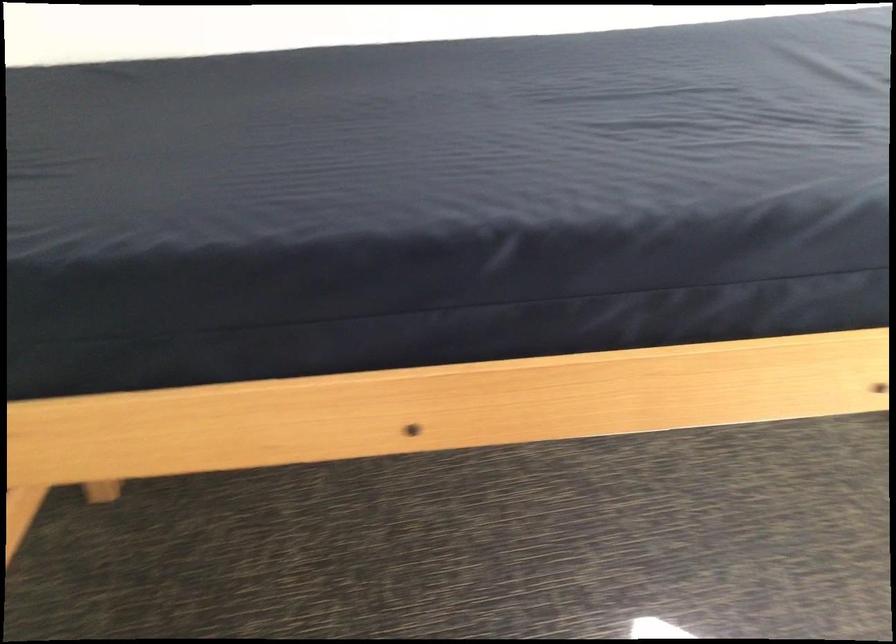
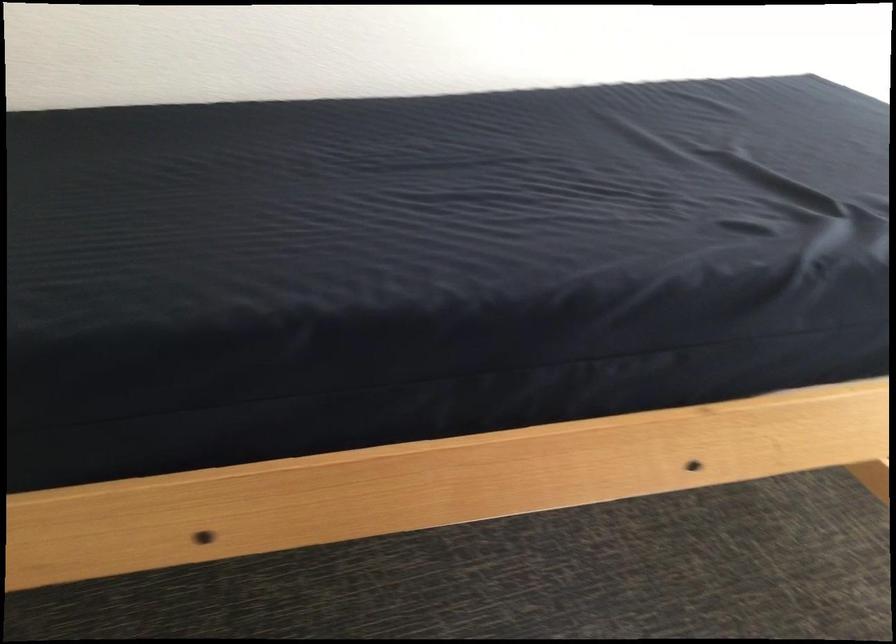
Question: How did the camera likely rotate?

Choices:
 (A) Left
 (B) Right
 (C) Up
 (D) Down

Answer: (B)